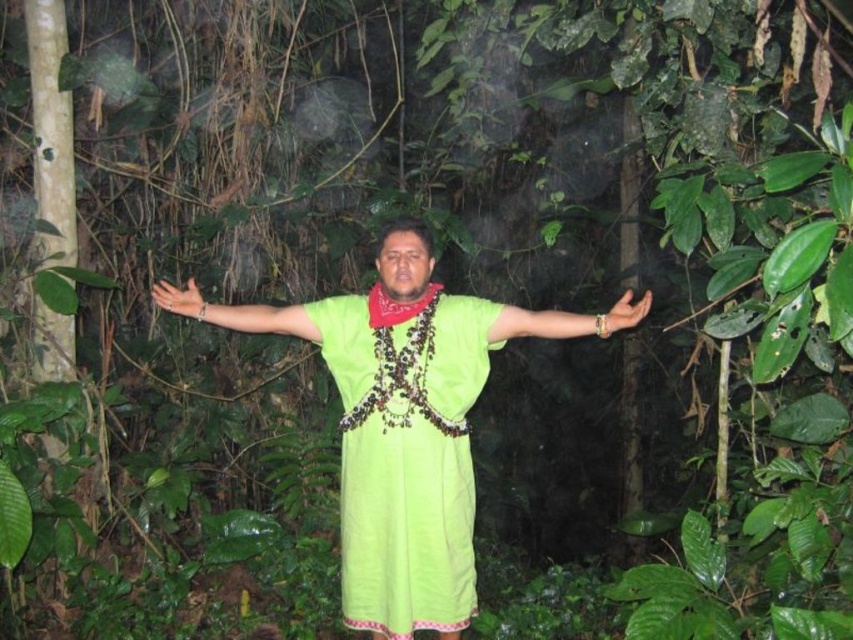
Is lime green fabric dress at center further to the viewer compared to green matte arm at center?

No, it is in front of green matte arm at center.

Can you confirm if lime green fabric dress at center is shorter than green matte arm at center?

Incorrect, lime green fabric dress at center's height does not fall short of green matte arm at center's.

Describe the element at coordinates (405, 458) in the screenshot. I see `lime green fabric dress at center` at that location.

This screenshot has height=640, width=853. I want to click on lime green fabric dress at center, so click(405, 458).

Who is lower down, green matte arm at center or matte green hand at center?

green matte arm at center

Does green matte arm at center have a lesser width compared to matte green hand at center?

Incorrect, green matte arm at center's width is not less than matte green hand at center's.

Which is in front, point (282, 317) or point (189, 298)?

Positioned in front is point (282, 317).

Where is `green matte arm at center`? Image resolution: width=853 pixels, height=640 pixels. green matte arm at center is located at coordinates (235, 312).

Which is in front, point (410, 573) or point (601, 324)?

Point (601, 324) is in front.

Does point (413, 456) come behind point (521, 330)?

No, (413, 456) is closer to viewer.

What do you see at coordinates (405, 458) in the screenshot?
I see `lime green fabric dress at center` at bounding box center [405, 458].

You are a GUI agent. You are given a task and a screenshot of the screen. Output one action in this format:
    pyautogui.click(x=<x>, y=<y>)
    Task: Click on the lime green fabric dress at center
    Image resolution: width=853 pixels, height=640 pixels.
    Given the screenshot: What is the action you would take?
    pyautogui.click(x=405, y=458)